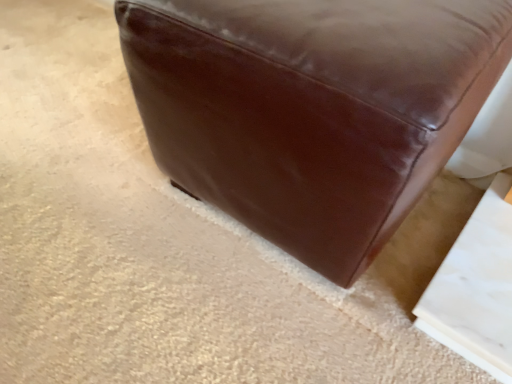
What do you see at coordinates (312, 109) in the screenshot? I see `shiny brown leather ottoman at center` at bounding box center [312, 109].

Identify the location of shiny brown leather ottoman at center. (312, 109).

Find the location of a particular element. shiny brown leather ottoman at center is located at coordinates (312, 109).